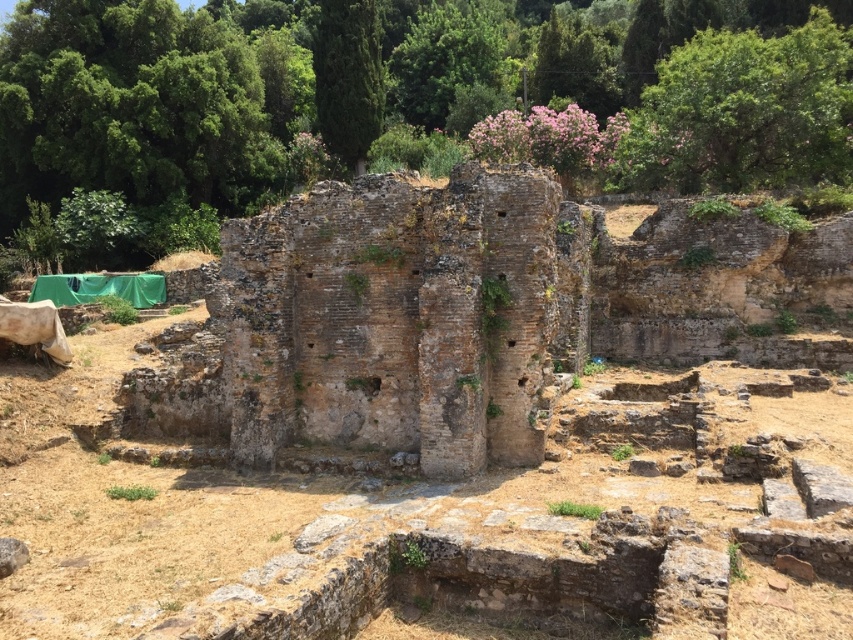
Is brown stone ruins at center further to the viewer compared to green textured tree at upper center?

No, it is in front of green textured tree at upper center.

Is brown stone ruins at center thinner than green textured tree at upper center?

In fact, brown stone ruins at center might be wider than green textured tree at upper center.

Is point (505, 186) closer to viewer compared to point (364, 104)?

Yes, point (505, 186) is in front of point (364, 104).

The image size is (853, 640). Find the location of `brown stone ruins at center`. brown stone ruins at center is located at coordinates (403, 317).

Does brown stone ruins at center appear under green leafy tree at upper right?

Indeed, brown stone ruins at center is positioned under green leafy tree at upper right.

Does brown stone ruins at center have a greater width compared to green leafy tree at upper right?

Incorrect, brown stone ruins at center's width does not surpass green leafy tree at upper right's.

This screenshot has width=853, height=640. Find the location of `brown stone ruins at center`. brown stone ruins at center is located at coordinates click(403, 317).

Identify the location of brown stone ruins at center. 403,317.

Does green leafy tree at upper right have a larger size compared to green textured tree at upper center?

Yes.

Can you confirm if green leafy tree at upper right is positioned to the left of green textured tree at upper center?

No, green leafy tree at upper right is not to the left of green textured tree at upper center.

Describe the element at coordinates (746, 112) in the screenshot. This screenshot has width=853, height=640. I see `green leafy tree at upper right` at that location.

At what (x,y) coordinates should I click in order to perform the action: click on green leafy tree at upper right. Please return your answer as a coordinate pair (x, y). The image size is (853, 640). Looking at the image, I should click on (746, 112).